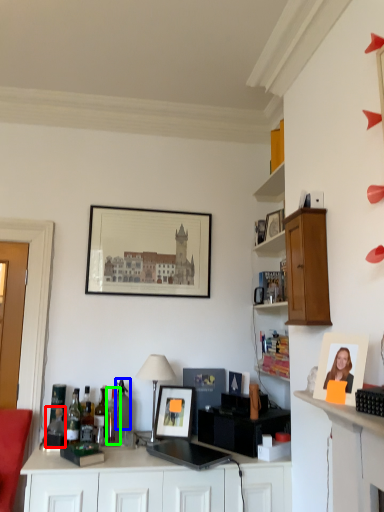
Question: Based on their relative distances, which object is farther from bottle (highlighted by a red box)? Choose from bottle (highlighted by a blue box) and bottle (highlighted by a green box).

Choices:
 (A) bottle
 (B) bottle

Answer: (A)